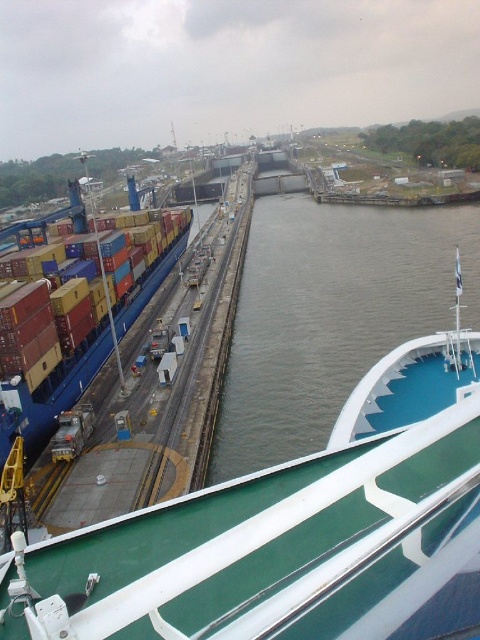
Does green matte boat at center have a lesser height compared to green smooth water at center?

Correct, green matte boat at center is not as tall as green smooth water at center.

Is green matte boat at center smaller than green smooth water at center?

Yes, green matte boat at center is smaller than green smooth water at center.

The width and height of the screenshot is (480, 640). What are the coordinates of `green matte boat at center` in the screenshot? It's located at [x=291, y=531].